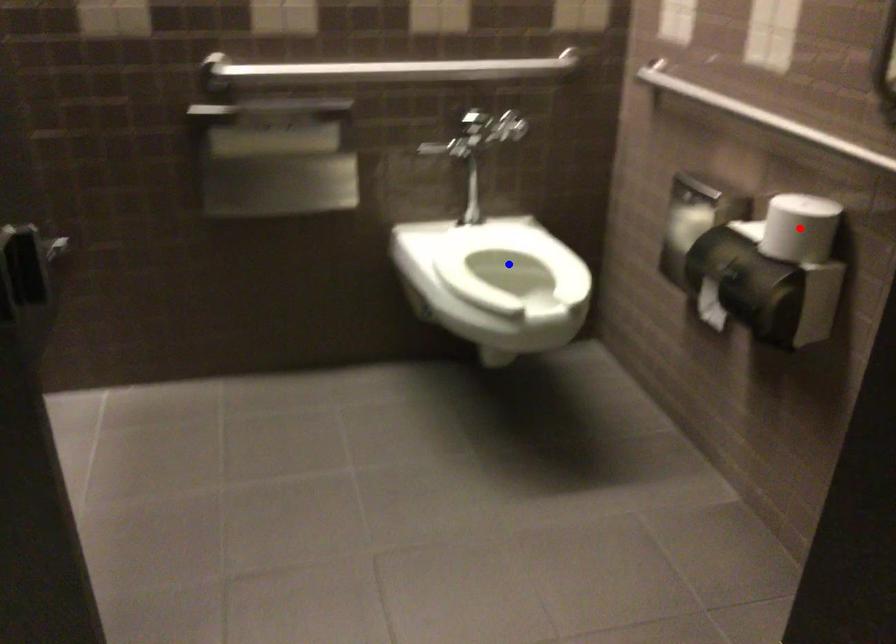
Question: Which of the two points in the image is closer to the camera?

Choices:
 (A) Blue point is closer.
 (B) Red point is closer.

Answer: (B)